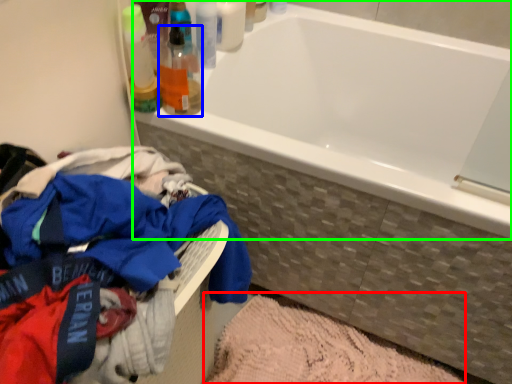
Question: Considering the real-world distances, which object is farthest from bath mat (highlighted by a red box)? toiletry (highlighted by a blue box) or bathtub (highlighted by a green box)?

Choices:
 (A) toiletry
 (B) bathtub

Answer: (A)